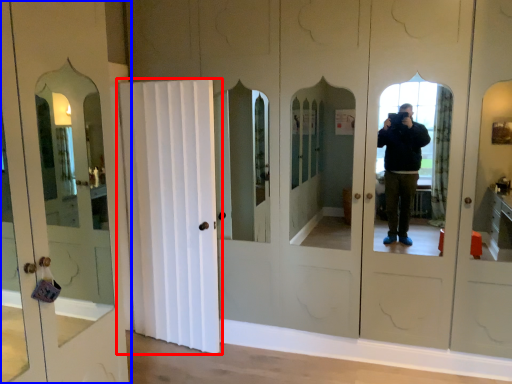
Question: Which object appears farthest to the camera in this image, door (highlighted by a red box) or door (highlighted by a blue box)?

Choices:
 (A) door
 (B) door

Answer: (A)